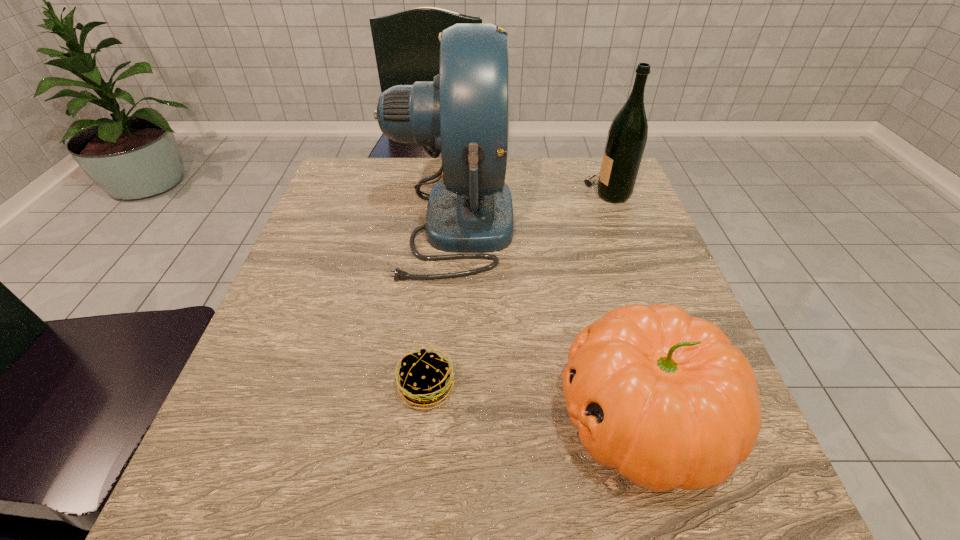
Locate an element on the screen. vacant space at the far left corner is located at coordinates (346, 178).

Find the location of a particular element. The image size is (960, 540). vacant region at the far right corner of the desktop is located at coordinates (594, 190).

Identify the location of vacant area at the near right corner of the desktop. This screenshot has height=540, width=960. (749, 503).

The height and width of the screenshot is (540, 960). In order to click on blank region between the shortest object and the wine bottle in this screenshot , I will do `click(517, 290)`.

Where is `empty location between the wine bottle and the shortest object`? This screenshot has height=540, width=960. empty location between the wine bottle and the shortest object is located at coordinates (517, 290).

Identify the location of free spot between the pumpkin and the wine bottle. (625, 305).

At what (x,y) coordinates should I click in order to perform the action: click on vacant space that is in between the second shortest object and the patty. Please return your answer as a coordinate pair (x, y). Looking at the image, I should click on (535, 402).

At what (x,y) coordinates should I click in order to perform the action: click on free space between the shortest object and the wine bottle. Please return your answer as a coordinate pair (x, y). The image size is (960, 540). Looking at the image, I should click on (517, 290).

I want to click on free spot between the third shortest object and the fan, so click(x=530, y=208).

Identify the location of vacant area that lies between the pumpkin and the fan. Image resolution: width=960 pixels, height=540 pixels. (547, 320).